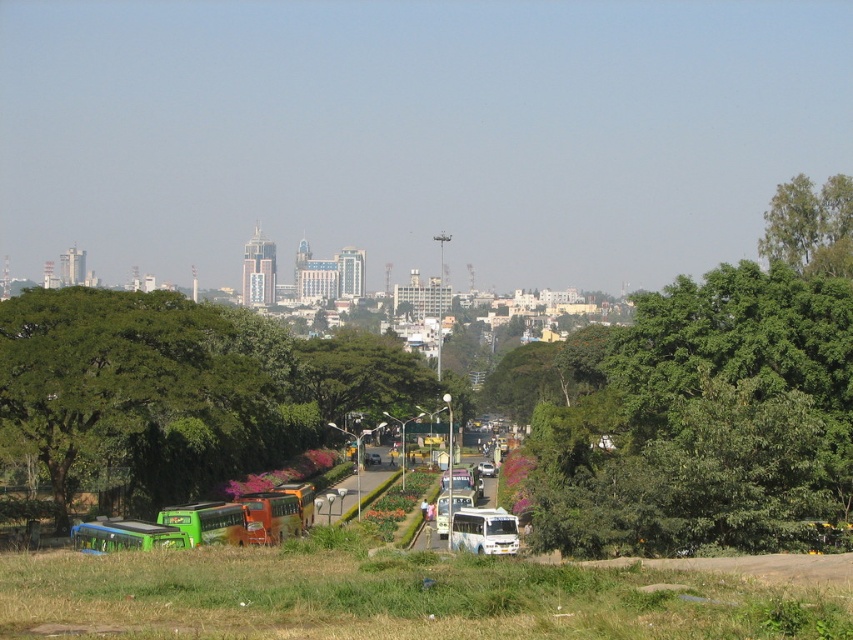
You are standing at the origin point of the coordinate system. You want to walk towards the green leafy tree at center. Which direction should you go?

You should move towards the coordinates point (363, 376) to reach the green leafy tree at center.

You are a city planner assessing the space between two green leafy trees. You need to install a bench that requires 3 meters of width. Based on the image, can the space between the green leafy tree at center and the green leafy tree at upper right accommodate the bench?

The green leafy tree at center might be wider than green leafy tree at upper right, so the space between them may not be sufficient to fit a 3 meter wide bench.